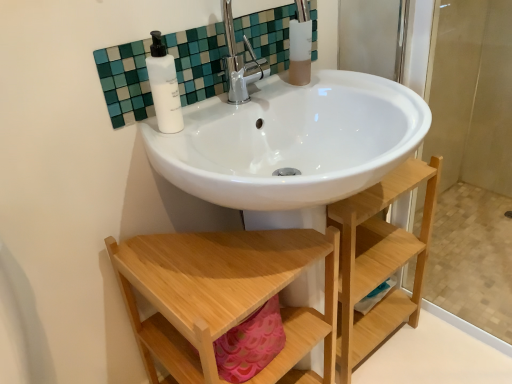
What is the approximate height of white matte bottle at upper center?

It is 18.03 centimeters.

What do you see at coordinates (164, 86) in the screenshot?
I see `white matte bottle at upper center` at bounding box center [164, 86].

At what (x,y) coordinates should I click in order to perform the action: click on translucent frosted glass cup at upper center. Please return your answer as a coordinate pair (x, y). Looking at the image, I should click on (300, 45).

Is natural wood shelf at lower center positioned with its back to white matte bottle at upper center?

No, natural wood shelf at lower center's orientation is not away from white matte bottle at upper center.

Is natural wood shelf at lower center completely or partially outside of white matte bottle at upper center?

Indeed, natural wood shelf at lower center is completely outside white matte bottle at upper center.

Is natural wood shelf at lower center wider or thinner than white matte bottle at upper center?

Considering their sizes, natural wood shelf at lower center looks broader than white matte bottle at upper center.

Is translucent frosted glass cup at upper center with white glossy sink at upper center?

No, translucent frosted glass cup at upper center is not making contact with white glossy sink at upper center.

Is translucent frosted glass cup at upper center facing away from white glossy sink at upper center?

Yes, translucent frosted glass cup at upper center's orientation is away from white glossy sink at upper center.

Between point (296, 77) and point (150, 96), which one is positioned behind?

Positioned behind is point (296, 77).

Considering the positions of objects natural wood shelf at lower center and white glossy sink at upper center in the image provided, who is behind, natural wood shelf at lower center or white glossy sink at upper center?

white glossy sink at upper center is behind.

Is natural wood shelf at lower center in contact with white glossy sink at upper center?

No, natural wood shelf at lower center is not making contact with white glossy sink at upper center.

Considering the relative sizes of natural wood shelf at lower center and white glossy sink at upper center in the image provided, is natural wood shelf at lower center wider than white glossy sink at upper center?

Yes.

Looking at this image, is natural wood shelf at lower center oriented towards white glossy sink at upper center?

No, natural wood shelf at lower center is not aimed at white glossy sink at upper center.

Considering the positions of points (155, 52) and (303, 0), is point (155, 52) closer to camera compared to point (303, 0)?

Yes.

In terms of height, does white matte bottle at upper center look taller or shorter compared to translucent frosted glass cup at upper center?

white matte bottle at upper center is shorter than translucent frosted glass cup at upper center.

Considering their positions, is white matte bottle at upper center located in front of or behind translucent frosted glass cup at upper center?

white matte bottle at upper center is positioned closer to the viewer than translucent frosted glass cup at upper center.

Considering the relative positions of white matte bottle at upper center and white glossy sink at upper center in the image provided, is white matte bottle at upper center behind white glossy sink at upper center?

No.

In the scene shown: Considering the relative sizes of white matte bottle at upper center and white glossy sink at upper center in the image provided, is white matte bottle at upper center wider than white glossy sink at upper center?

Yes.

Consider the image. Could you tell me if white matte bottle at upper center is turned towards white glossy sink at upper center?

No, white matte bottle at upper center is not facing towards white glossy sink at upper center.

From the image's perspective, is white matte bottle at upper center located above or below white glossy sink at upper center?

Clearly, from the image's perspective, white matte bottle at upper center is below white glossy sink at upper center.

Which object is more forward, translucent frosted glass cup at upper center or white matte bottle at upper center?

white matte bottle at upper center is in front.

Considering the relative sizes of translucent frosted glass cup at upper center and white matte bottle at upper center in the image provided, is translucent frosted glass cup at upper center smaller than white matte bottle at upper center?

Actually, translucent frosted glass cup at upper center might be larger than white matte bottle at upper center.

Is there a large distance between translucent frosted glass cup at upper center and white matte bottle at upper center?

translucent frosted glass cup at upper center is near white matte bottle at upper center, not far away.

How many degrees apart are the facing directions of white glossy sink at upper center and translucent frosted glass cup at upper center?

The angular difference between white glossy sink at upper center and translucent frosted glass cup at upper center is 0.000492 degrees.

From the image's perspective, relative to translucent frosted glass cup at upper center, is white glossy sink at upper center above or below?

Result: From the image's perspective, white glossy sink at upper center appears below translucent frosted glass cup at upper center.

Which of these two, white glossy sink at upper center or translucent frosted glass cup at upper center, stands shorter?

white glossy sink at upper center is shorter.

From a real-world perspective, does white glossy sink at upper center sit lower than translucent frosted glass cup at upper center?

Yes.

Locate an element on the screen. soap dispenser behind the natural wood shelf at lower center is located at coordinates (164, 86).

This screenshot has width=512, height=384. Find the location of `toiletry that appears above the white glossy sink at upper center (from the image's perspective)`. toiletry that appears above the white glossy sink at upper center (from the image's perspective) is located at coordinates (300, 45).

In the scene shown: Which object lies further to the anchor point white matte bottle at upper center, white glossy sink at upper center or translucent frosted glass cup at upper center?

Based on the image, translucent frosted glass cup at upper center appears to be further to white matte bottle at upper center.

Looking at the image, which one is located closer to translucent frosted glass cup at upper center, white matte bottle at upper center or white glossy sink at upper center?

Based on the image, white glossy sink at upper center appears to be nearer to translucent frosted glass cup at upper center.

In the scene shown: Considering their positions, is natural wood shelf at lower center positioned further to white glossy sink at upper center than white matte bottle at upper center?

natural wood shelf at lower center is positioned further to the anchor white glossy sink at upper center.

Looking at the image, which one is located further to white matte bottle at upper center, white glossy sink at upper center or natural wood shelf at lower center?

natural wood shelf at lower center is positioned further to the anchor white matte bottle at upper center.

Based on their spatial positions, is translucent frosted glass cup at upper center or natural wood shelf at lower center further from white glossy sink at upper center?

natural wood shelf at lower center.

Estimate the real-world distances between objects in this image. Which object is further from white matte bottle at upper center, translucent frosted glass cup at upper center or natural wood shelf at lower center?

natural wood shelf at lower center.

Considering their positions, is natural wood shelf at lower center positioned closer to translucent frosted glass cup at upper center than white matte bottle at upper center?

white matte bottle at upper center.

From the image, which object appears to be farther from natural wood shelf at lower center, translucent frosted glass cup at upper center or white glossy sink at upper center?

Among the two, translucent frosted glass cup at upper center is located further to natural wood shelf at lower center.

Locate an element on the screen. This screenshot has width=512, height=384. mirror that lies between translucent frosted glass cup at upper center and natural wood shelf at lower center from top to bottom is located at coordinates (199, 61).

Where is `soap dispenser between translucent frosted glass cup at upper center and natural wood shelf at lower center vertically`? soap dispenser between translucent frosted glass cup at upper center and natural wood shelf at lower center vertically is located at coordinates click(x=164, y=86).

Locate an element on the screen. The width and height of the screenshot is (512, 384). mirror situated between white matte bottle at upper center and translucent frosted glass cup at upper center from left to right is located at coordinates (199, 61).

The width and height of the screenshot is (512, 384). In order to click on soap dispenser between white glossy sink at upper center and natural wood shelf at lower center in the up-down direction in this screenshot , I will do `click(164, 86)`.